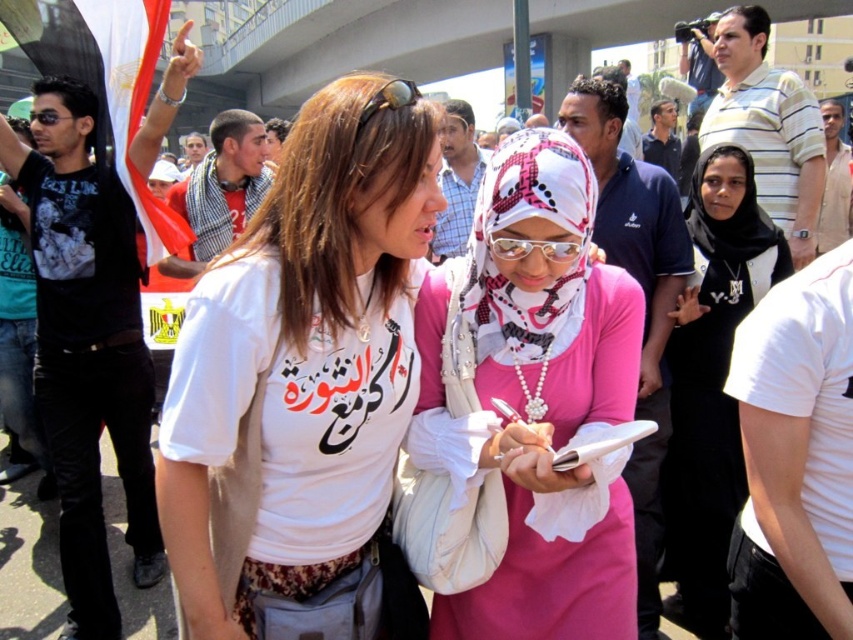
At what (x,y) coordinates should I click in order to perform the action: click on pink printed scarf at center. Please return your answer as a coordinate pair (x, y). The height and width of the screenshot is (640, 853). Looking at the image, I should click on (521, 220).

The height and width of the screenshot is (640, 853). What do you see at coordinates (521, 220) in the screenshot?
I see `pink printed scarf at center` at bounding box center [521, 220].

Which is in front, point (573, 225) or point (415, 84)?

Point (415, 84) is in front.

I want to click on pink printed scarf at center, so click(x=521, y=220).

Is transparent plastic goggles at center shorter than gold metallic goggles at center?

Yes, transparent plastic goggles at center is shorter than gold metallic goggles at center.

Based on the photo, who is positioned more to the left, transparent plastic goggles at center or gold metallic goggles at center?

From the viewer's perspective, gold metallic goggles at center appears more on the left side.

Measure the distance between point [491,241] and camera.

Point [491,241] and camera are 7.57 feet apart.

At what (x,y) coordinates should I click in order to perform the action: click on transparent plastic goggles at center. Please return your answer as a coordinate pair (x, y). Looking at the image, I should click on [x=534, y=246].

Which is below, white matte t-shirt at center or gold metallic goggles at center?

white matte t-shirt at center is below.

Describe the element at coordinates (303, 356) in the screenshot. The width and height of the screenshot is (853, 640). I see `white matte t-shirt at center` at that location.

I want to click on white matte t-shirt at center, so click(303, 356).